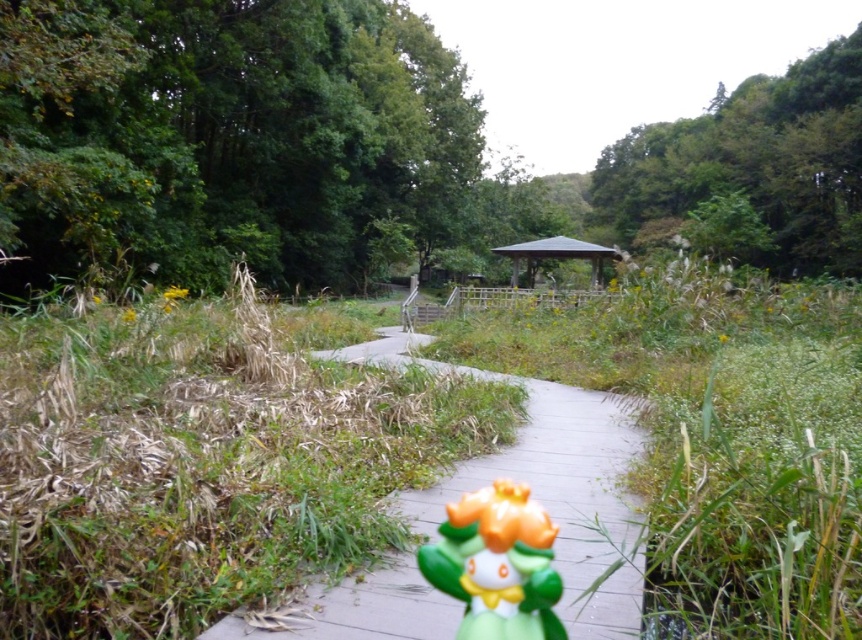
Is wooden at center shorter than green plastic figurine at center?

Indeed, wooden at center has a lesser height compared to green plastic figurine at center.

Who is taller, wooden at center or green plastic figurine at center?

Standing taller between the two is green plastic figurine at center.

What are the coordinates of `wooden at center` in the screenshot? It's located at (547, 483).

Can you confirm if wooden at center is thinner than green wooden gazebo at center?

Yes.

Is wooden at center below green wooden gazebo at center?

Correct, wooden at center is located below green wooden gazebo at center.

Does point (575, 481) come behind point (528, 285)?

No, it is in front of (528, 285).

The height and width of the screenshot is (640, 862). I want to click on wooden at center, so click(x=547, y=483).

Does green grass at center appear over wooden at center?

Yes, green grass at center is above wooden at center.

Does green grass at center appear under wooden at center?

Actually, green grass at center is above wooden at center.

Who is more distant from viewer, (x=225, y=346) or (x=291, y=611)?

The point (x=225, y=346) is more distant.

Find the location of a particular element. This screenshot has width=862, height=640. green grass at center is located at coordinates (203, 467).